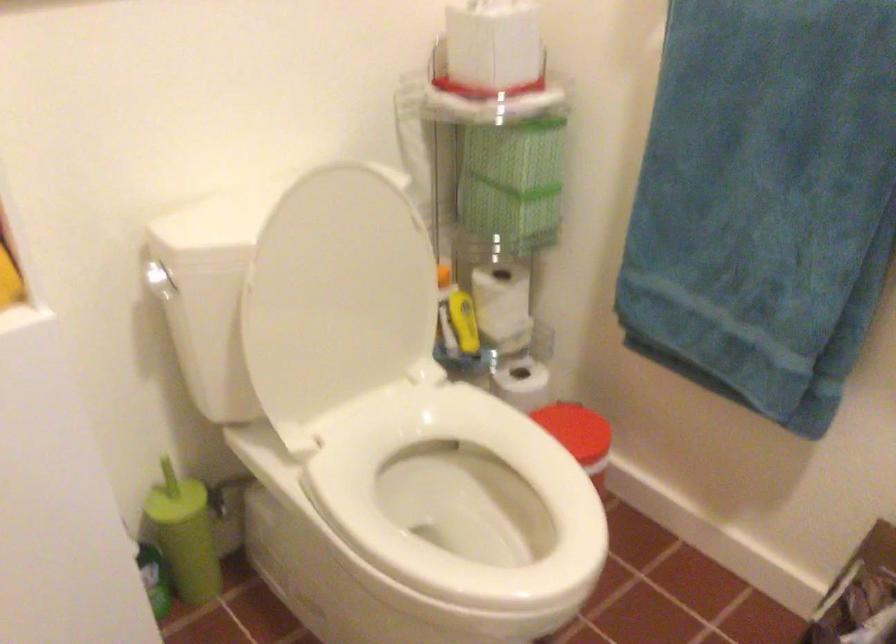
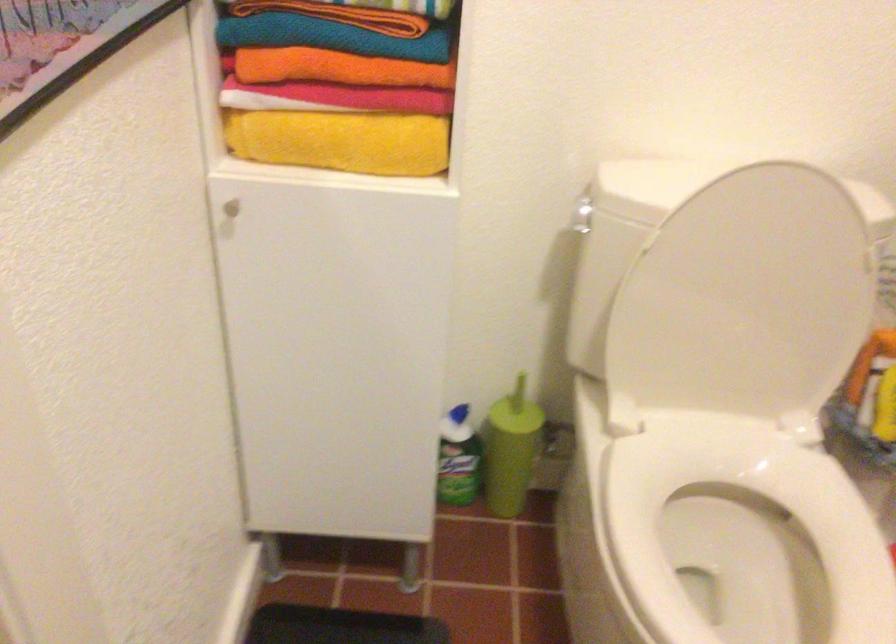
Question: Based on the continuous images, in which direction is the camera rotating? Reply with the corresponding letter.

Choices:
 (A) Left
 (B) Right
 (C) Up
 (D) Down

Answer: (A)